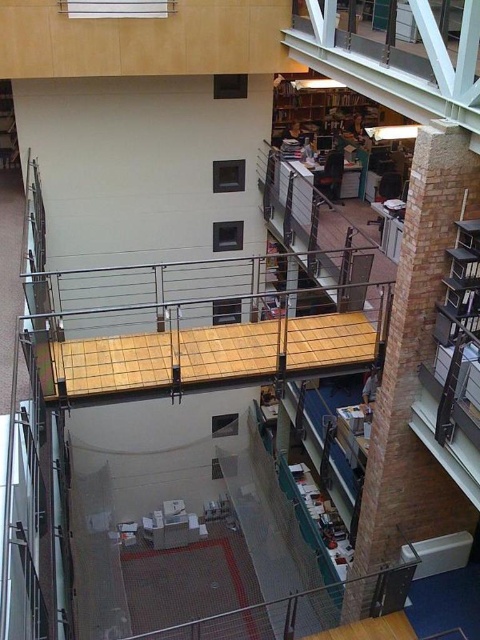
Question: Can you confirm if brick wall at right is smaller than wooden bookshelf at upper center?

Choices:
 (A) no
 (B) yes

Answer: (B)

Question: Which point is closer to the camera taking this photo?

Choices:
 (A) (335, 122)
 (B) (8, 141)
 (C) (459, 198)

Answer: (C)

Question: Which point is closer to the camera?

Choices:
 (A) brick wall at right
 (B) wooden bookshelf at upper left
 (C) wooden bookshelf at upper center

Answer: (A)

Question: Is wooden bookshelf at upper center smaller than wooden bookshelf at upper left?

Choices:
 (A) no
 (B) yes

Answer: (A)

Question: Can you confirm if wooden bookshelf at upper center is positioned below wooden bookshelf at upper left?

Choices:
 (A) no
 (B) yes

Answer: (A)

Question: Which point is closer to the camera?

Choices:
 (A) wooden bookshelf at upper center
 (B) brick wall at right
 (C) wooden bookshelf at upper left

Answer: (B)